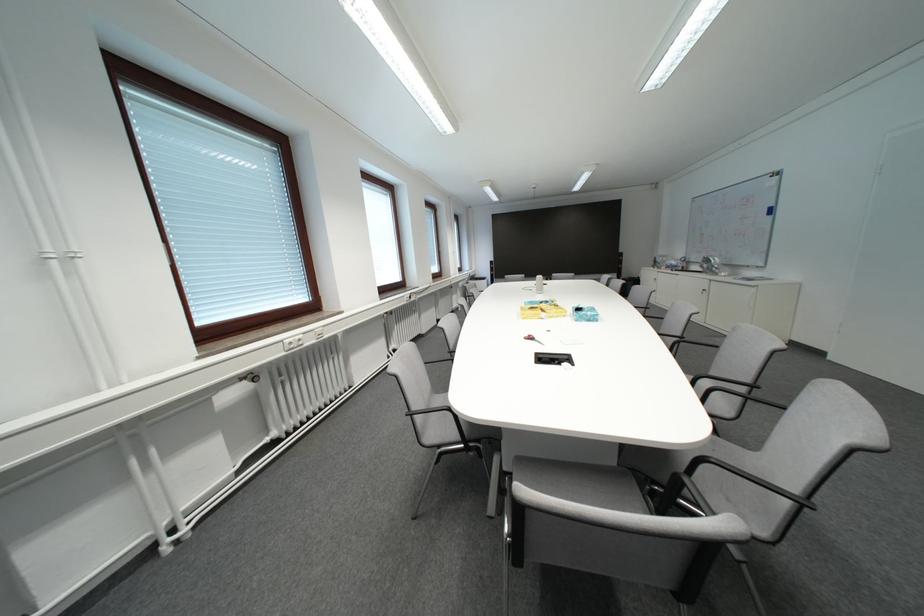
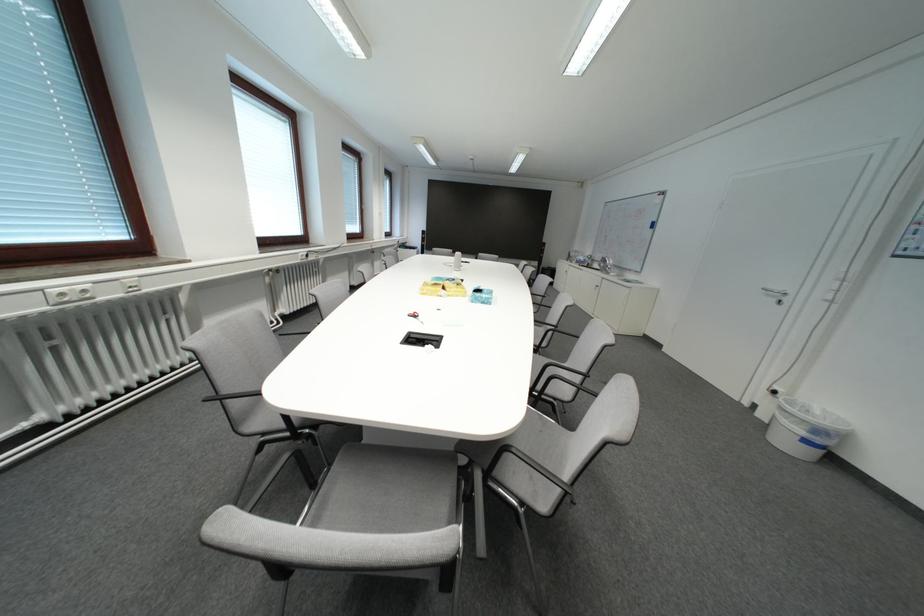
Question: What movement of the cameraman would produce the second image?

Choices:
 (A) Left
 (B) Right
 (C) Forward
 (D) Backward

Answer: (B)